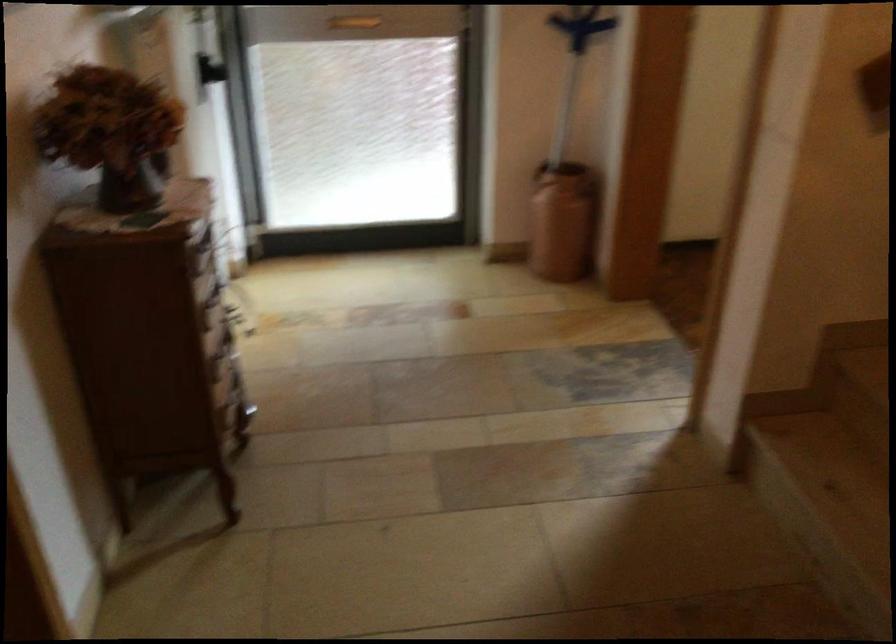
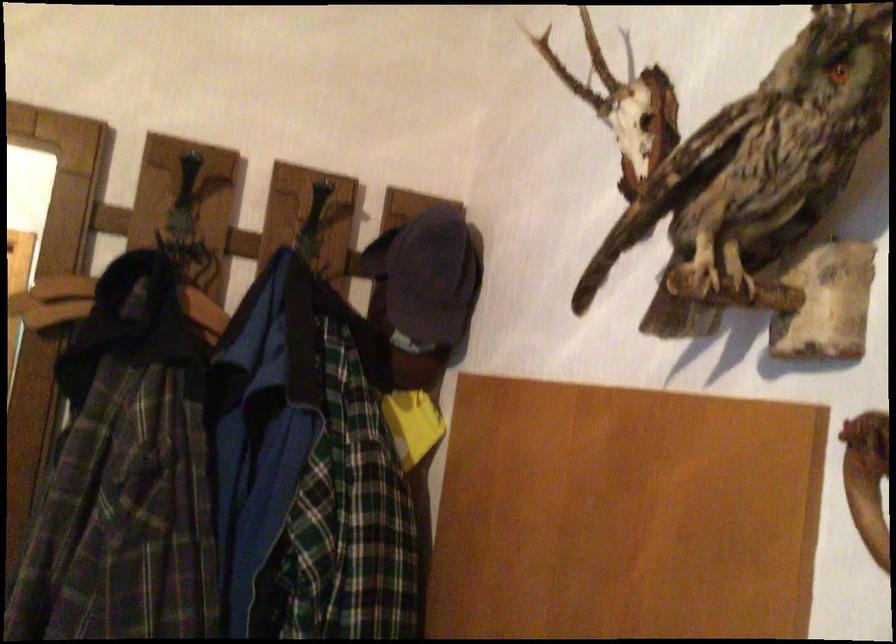
Question: The first image is from the beginning of the video and the second image is from the end. How did the camera likely rotate when shooting the video?

Choices:
 (A) Left
 (B) Right
 (C) Up
 (D) Down

Answer: (B)